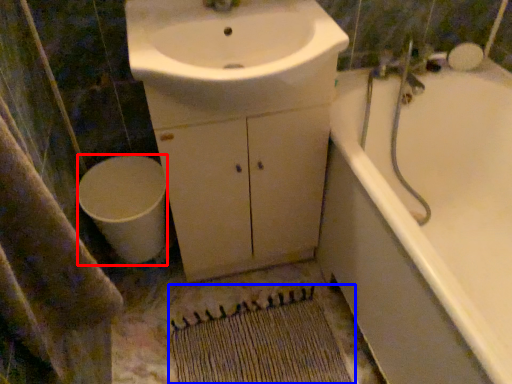
Question: Which point is closer to the camera, toilet (highlighted by a red box) or doormat (highlighted by a blue box)?

Choices:
 (A) toilet
 (B) doormat

Answer: (B)